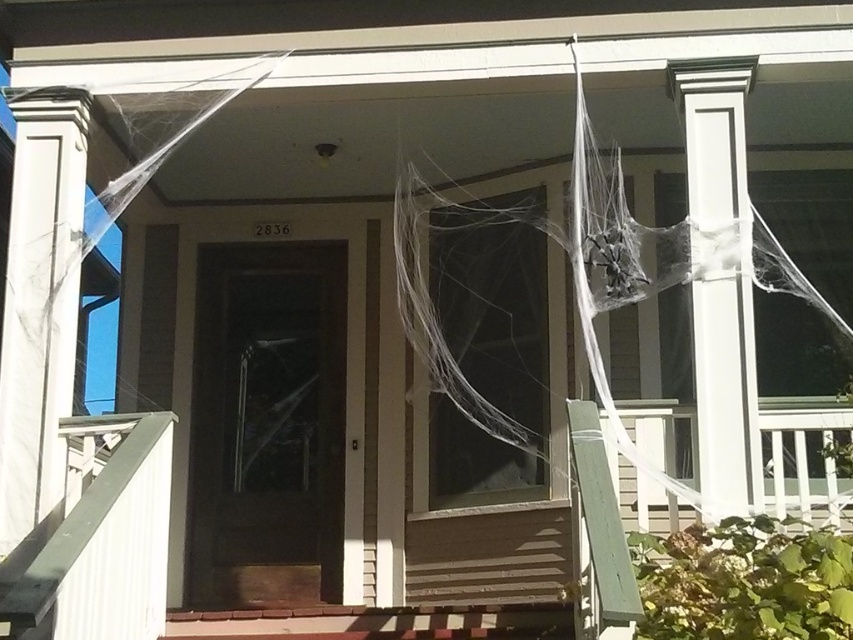
You are a guest arriving at this Halloween house. You notice the translucent white spider web at center and the white painted wood column at center. Which object is positioned higher in the scene?

The translucent white spider web at center is above the white painted wood column at center, so it is positioned higher in the scene.

Consider the image. You are standing at the front porch of the house decorated for Halloween. You see a dark wood screen door at center. If you want to place a pumpkin decoration exactly at the point with coordinates (267, 426), will it be placed on the dark wood screen door at center?

Yes, the point (267, 426) corresponds to the dark wood screen door at center, so placing the pumpkin decoration there would put it directly on the dark wood screen door at center.

You are standing on the front porch of a house decorated for Halloween. You see two points marked on the image. The first point is at position point (202, 541) and the second is at point (624, 227). If you were to walk from the first point to the second point, would you be moving forward or backward relative to the porch?

Since point (202, 541) is behind point (624, 227), moving from the first point to the second point would mean moving forward towards the porch entrance.